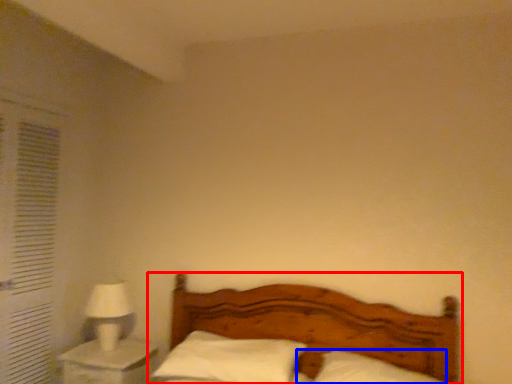
Question: Which point is further to the camera, bed (highlighted by a red box) or pillow (highlighted by a blue box)?

Choices:
 (A) bed
 (B) pillow

Answer: (B)